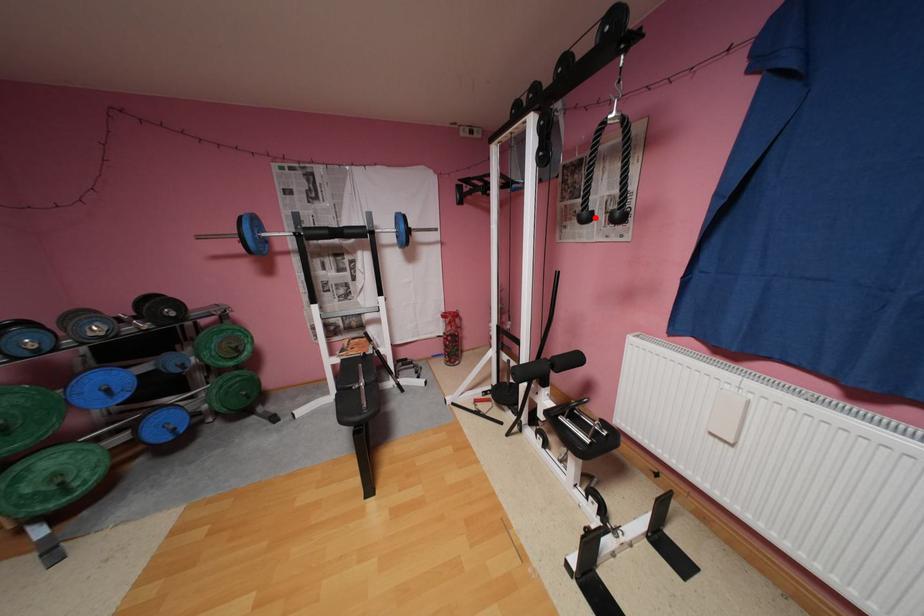
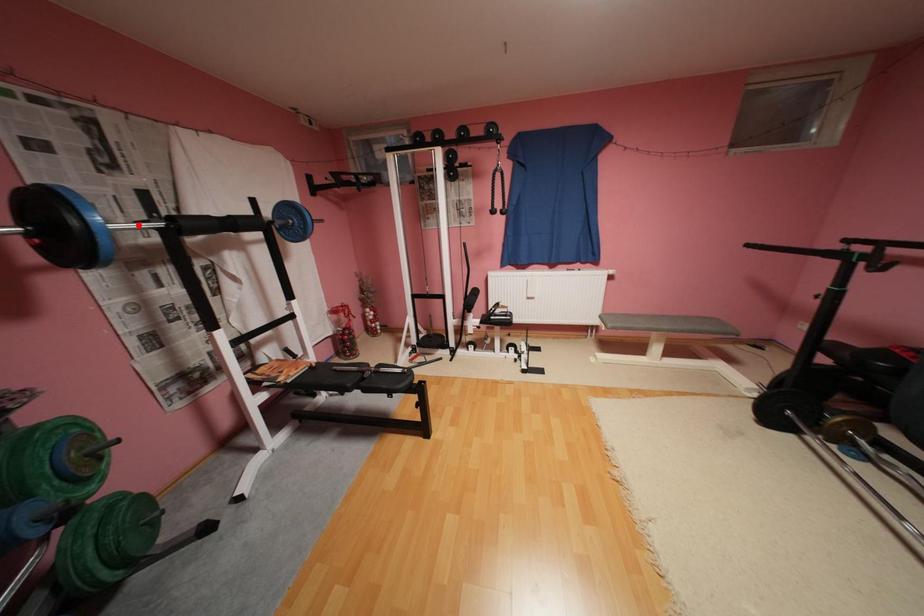
I am providing you with two images of the same scene from different viewpoints. A red point is marked on the first image and another point is marked on the second image. Is the red point in image1 aligned with the point shown in image2?

No